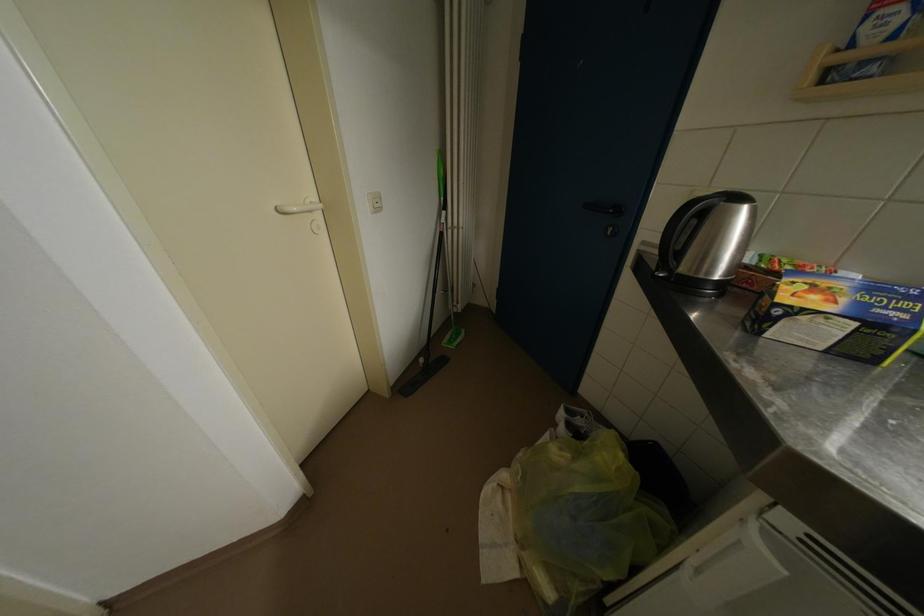
Locate an element on the screen. The image size is (924, 616). white light switch is located at coordinates (374, 201).